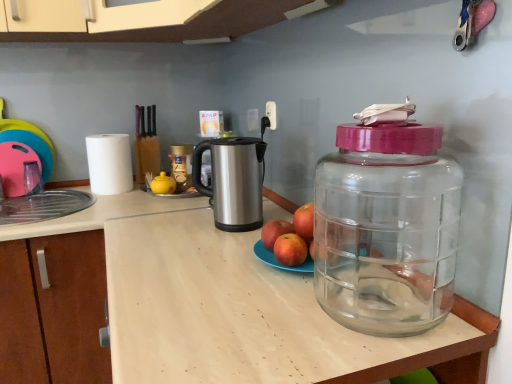
Question: Does transparent plastic bottle at right, the second bottle viewed from the back, appear on the right side of white matte paper towel at left?

Choices:
 (A) no
 (B) yes

Answer: (B)

Question: Considering the relative positions of transparent plastic bottle at right, the second bottle viewed from the back, and white matte paper towel at left in the image provided, is transparent plastic bottle at right, the second bottle viewed from the back, in front of white matte paper towel at left?

Choices:
 (A) no
 (B) yes

Answer: (B)

Question: Is white matte paper towel at left completely or partially inside transparent plastic bottle at right, which ranks as the 2th bottle in left-to-right order?

Choices:
 (A) yes
 (B) no

Answer: (B)

Question: Considering the relative sizes of transparent plastic bottle at right, which ranks as the 2th bottle in left-to-right order, and white matte paper towel at left in the image provided, is transparent plastic bottle at right, which ranks as the 2th bottle in left-to-right order, thinner than white matte paper towel at left?

Choices:
 (A) no
 (B) yes

Answer: (A)

Question: Is the depth of transparent plastic bottle at right, arranged as the 1th bottle when viewed from the front, greater than that of white matte paper towel at left?

Choices:
 (A) yes
 (B) no

Answer: (B)

Question: Considering the positions of red matte apple at center, the 3th apple viewed from the right, and red matte apple at center, which is the 3th apple from left to right, in the image, is red matte apple at center, the 3th apple viewed from the right, taller or shorter than red matte apple at center, which is the 3th apple from left to right,?

Choices:
 (A) tall
 (B) short

Answer: (A)

Question: Is point (267, 233) positioned closer to the camera than point (313, 253)?

Choices:
 (A) closer
 (B) farther

Answer: (B)

Question: From the image's perspective, relative to red matte apple at center, which is the 3th apple from left to right, is red matte apple at center, the first apple positioned from the left, above or below?

Choices:
 (A) below
 (B) above

Answer: (B)

Question: In the image, is red matte apple at center, the 3th apple viewed from the right, on the left side or the right side of red matte apple at center, the 1th apple positioned from the right?

Choices:
 (A) right
 (B) left

Answer: (B)

Question: In terms of height, does silver metallic kettle at center look taller or shorter compared to red matte apple at center, the 3th apple viewed from the right?

Choices:
 (A) tall
 (B) short

Answer: (A)

Question: Is silver metallic kettle at center inside the boundaries of red matte apple at center, the 3th apple viewed from the right, or outside?

Choices:
 (A) inside
 (B) outside

Answer: (B)

Question: From a real-world perspective, is silver metallic kettle at center positioned above or below red matte apple at center, the 3th apple viewed from the right?

Choices:
 (A) below
 (B) above

Answer: (B)

Question: Considering the positions of point (228, 228) and point (268, 233), is point (228, 228) closer or farther from the camera than point (268, 233)?

Choices:
 (A) closer
 (B) farther

Answer: (B)

Question: Is point (418, 259) positioned closer to the camera than point (109, 168)?

Choices:
 (A) closer
 (B) farther

Answer: (A)

Question: From their relative heights in the image, would you say transparent plastic bottle at right, which is the first bottle in right-to-left order, is taller or shorter than white matte paper towel at left?

Choices:
 (A) short
 (B) tall

Answer: (B)